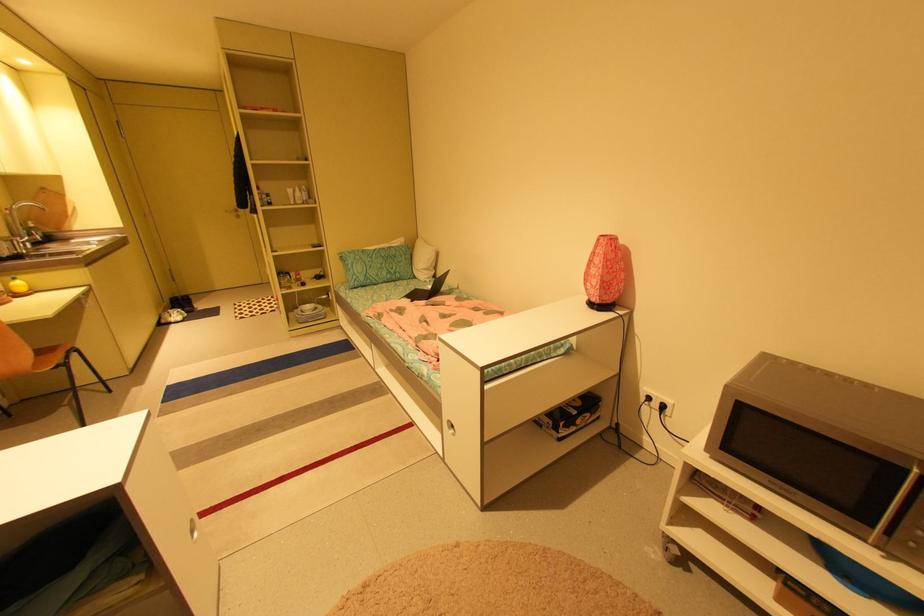
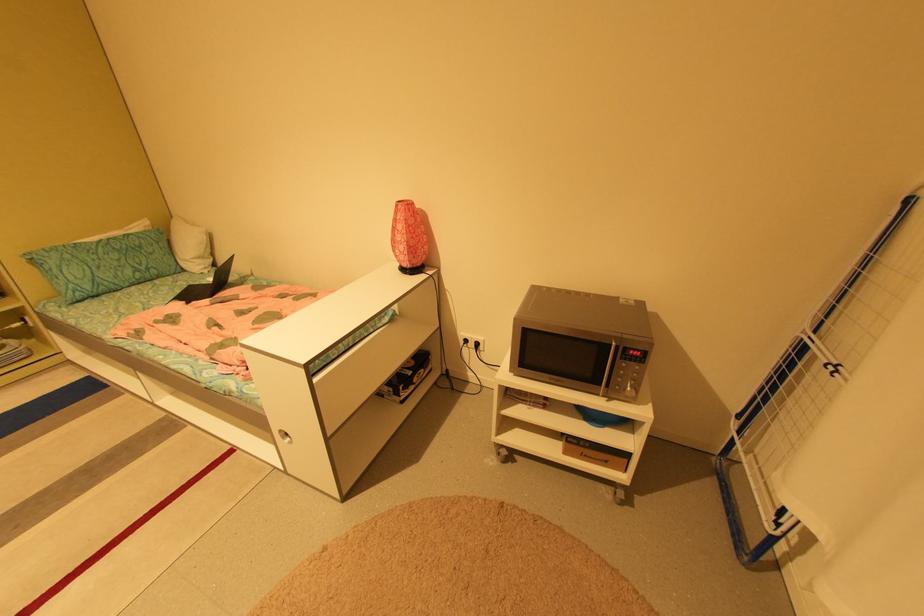
Locate, in the second image, the point that corresponds to (608,236) in the first image.

(406, 201)